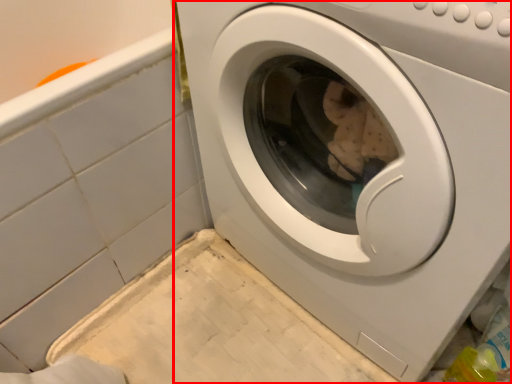
Question: Observing the image, what is the correct spatial positioning of washing machine (annotated by the red box) in reference to bath?

Choices:
 (A) left
 (B) right

Answer: (B)